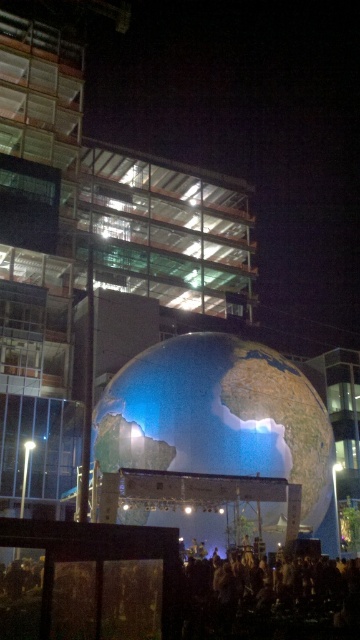
Question: Does shiny metallic globe at center have a lesser width compared to dark textured crowd at lower center?

Choices:
 (A) yes
 (B) no

Answer: (B)

Question: Can you confirm if shiny metallic globe at center is positioned to the left of dark textured crowd at lower center?

Choices:
 (A) yes
 (B) no

Answer: (A)

Question: Which object is farther from the camera taking this photo?

Choices:
 (A) dark textured crowd at lower center
 (B) shiny metallic globe at center

Answer: (B)

Question: Where is shiny metallic globe at center located in relation to dark textured crowd at lower center in the image?

Choices:
 (A) right
 (B) left

Answer: (B)